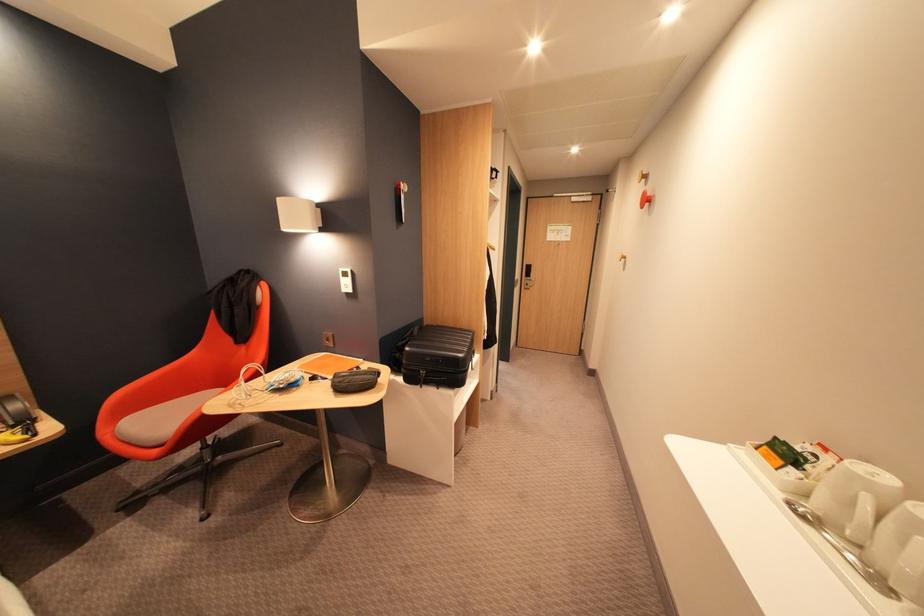
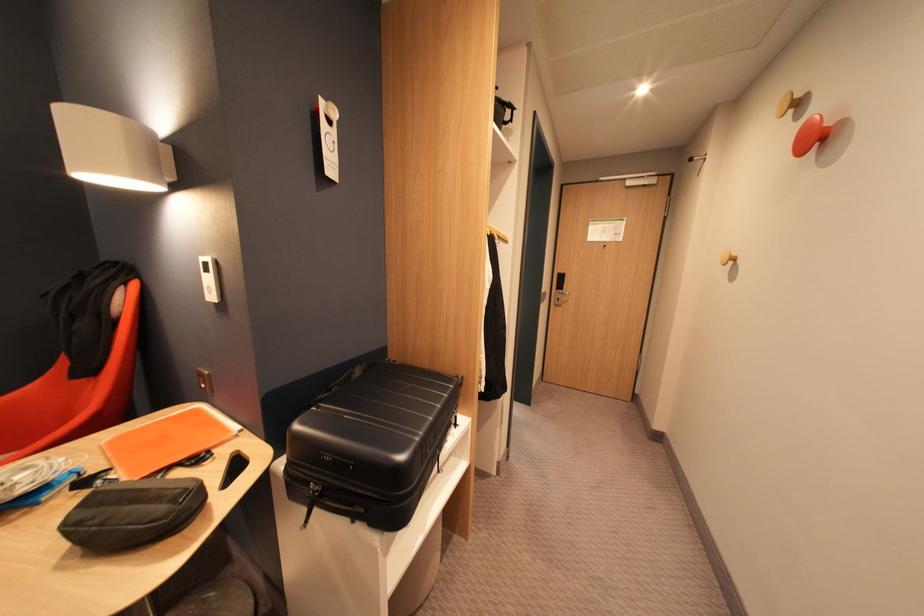
Question: Which direction would the cameraman need to move to produce the second image? Reply with the corresponding letter.

Choices:
 (A) Left
 (B) Right
 (C) Forward
 (D) Backward

Answer: (C)